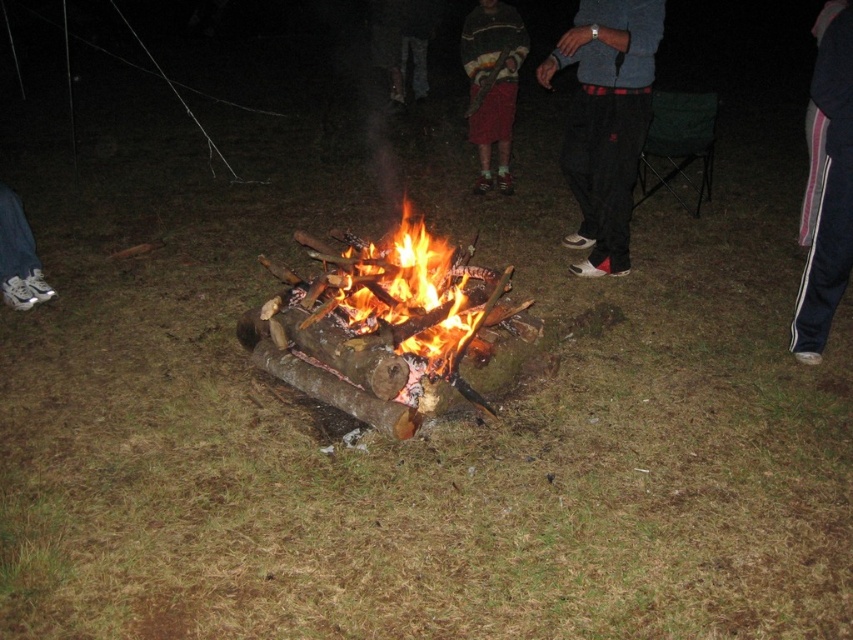
Question: Does dark gray pants at center appear over pink striped pants at lower right?

Choices:
 (A) yes
 (B) no

Answer: (A)

Question: Which object is the farthest from the dark gray pants at center?

Choices:
 (A) burning wood at center
 (B) white sneakers at left

Answer: (B)

Question: Is dark gray pants at center wider than white sneakers at left?

Choices:
 (A) yes
 (B) no

Answer: (A)

Question: Is burning wood at center wider than dark blue jeans at center?

Choices:
 (A) yes
 (B) no

Answer: (A)

Question: Which point is farther from the camera taking this photo?

Choices:
 (A) (469, 36)
 (B) (404, 4)
 (C) (373, 316)
 (D) (809, 253)

Answer: (B)

Question: Which of the following is the farthest from the observer?

Choices:
 (A) pyautogui.click(x=428, y=246)
 (B) pyautogui.click(x=625, y=20)
 (C) pyautogui.click(x=838, y=122)

Answer: (A)